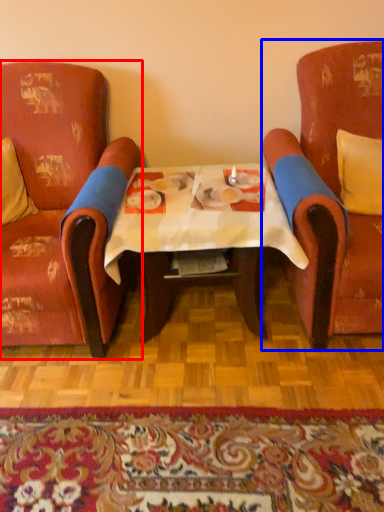
Question: Which of the following is the farthest to the observer, chair (highlighted by a red box) or chair (highlighted by a blue box)?

Choices:
 (A) chair
 (B) chair

Answer: (A)